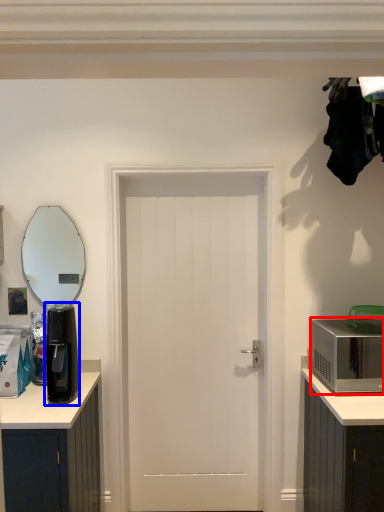
Question: Which object appears farthest to the camera in this image, microwave oven (highlighted by a red box) or appliance (highlighted by a blue box)?

Choices:
 (A) microwave oven
 (B) appliance

Answer: (A)